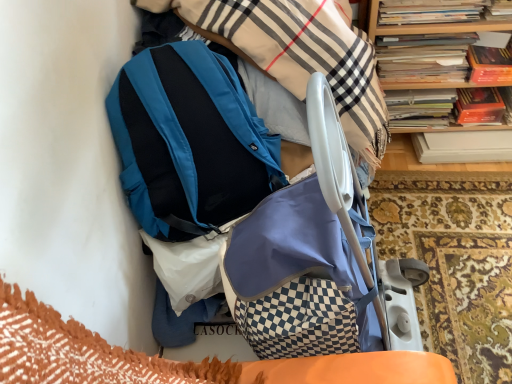
Question: In terms of size, does matte blue baby carriage at center appear bigger or smaller than hardcover books at upper right, which is the first book from back to front?

Choices:
 (A) big
 (B) small

Answer: (A)

Question: Considering the positions of matte blue baby carriage at center and hardcover books at upper right, which is the first book from back to front, in the image, is matte blue baby carriage at center wider or thinner than hardcover books at upper right, which is the first book from back to front,?

Choices:
 (A) thin
 (B) wide

Answer: (B)

Question: Which object is positioned farthest from the hardcover book at upper right?

Choices:
 (A) matte blue baby carriage at center
 (B) hardcover books at upper right, which is the first book from back to front
 (C) hardcover book at upper right, positioned as the 1th book in front-to-back order
 (D) wooden bookcase at upper right
 (E) teal matte backpack at upper center

Answer: (E)

Question: Estimate the real-world distances between objects in this image. Which object is closer to the wooden bookcase at upper right?

Choices:
 (A) hardcover books at upper right, placed as the 2th book when sorted from front to back
 (B) teal matte backpack at upper center
 (C) hardcover book at upper right, positioned as the 1th book in front-to-back order
 (D) matte blue baby carriage at center
 (E) hardcover book at upper right

Answer: (A)